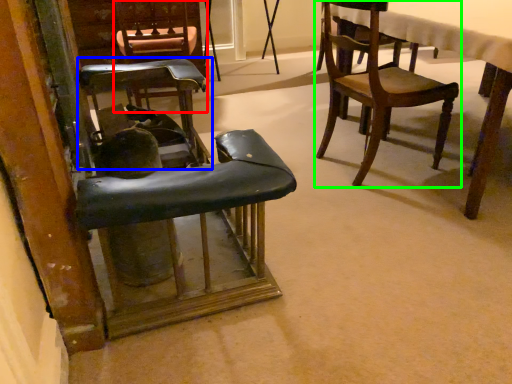
Question: Which object is positioned farthest from chair (highlighted by a red box)? Select from chair (highlighted by a blue box) and chair (highlighted by a green box).

Choices:
 (A) chair
 (B) chair

Answer: (B)